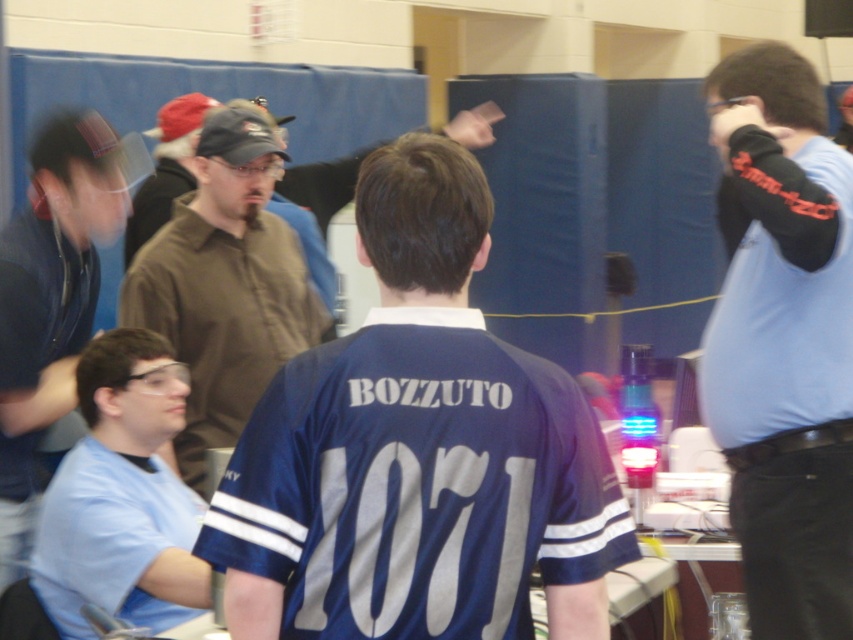
You are standing at the point with coordinates (416, 451) in the image. What object are you currently standing on?

You are standing on the blue jersey at center.

You are organizing a team photo and need to arrange the blue jersey at center and the matte black shirt at left side by side. Based on the image, which clothing item might require more space horizontally?

The blue jersey at center might be wider than the matte black shirt at left, so it would require more horizontal space.